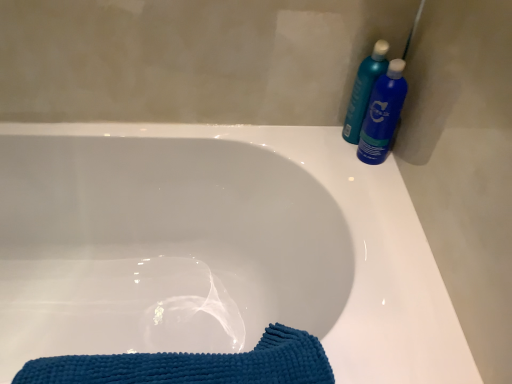
Image resolution: width=512 pixels, height=384 pixels. What are the coordinates of `free spot in front of blue glossy bottle at upper right, arranged as the second cleaning product when viewed from the left` in the screenshot? It's located at (381, 190).